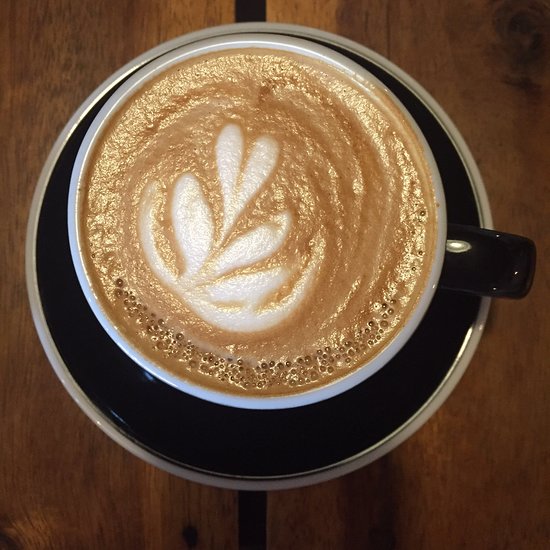
You are a GUI agent. You are given a task and a screenshot of the screen. Output one action in this format:
    pyautogui.click(x=<x>, y=<y>)
    Task: Click on the black saucer
    The height and width of the screenshot is (550, 550).
    Given the screenshot: What is the action you would take?
    pyautogui.click(x=187, y=455)